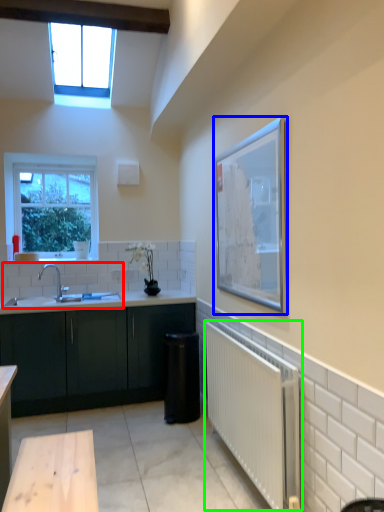
Question: Which object is positioned closest to sink (highlighted by a red box)? Select from picture frame (highlighted by a blue box) and radiator (highlighted by a green box).

Choices:
 (A) picture frame
 (B) radiator

Answer: (B)